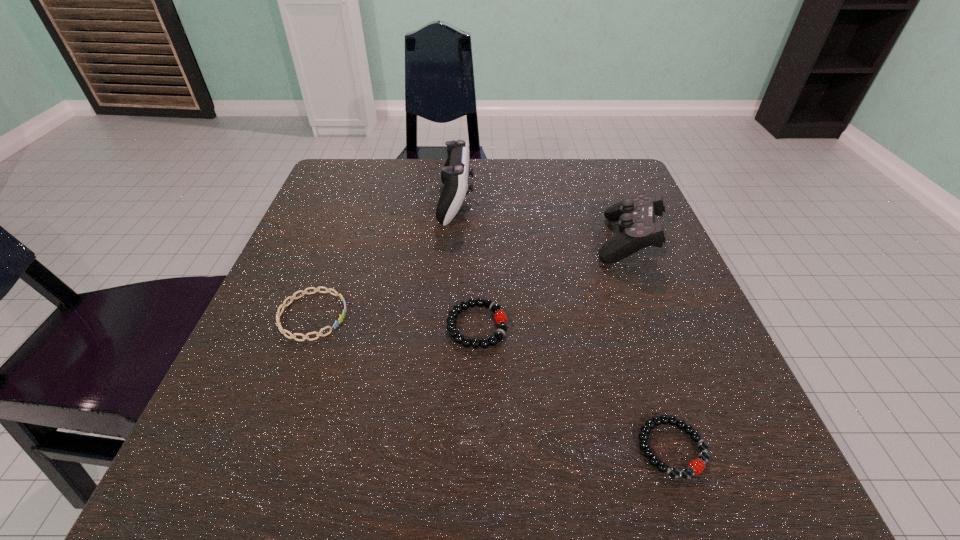
Find the location of a particular element. vacant space that satisfies the following two spatial constraints: 1. on the front side of the second bracelet from left to right; 2. on the right side of the nearest bracelet is located at coordinates (476, 448).

The height and width of the screenshot is (540, 960). What are the coordinates of `free location that satisfies the following two spatial constraints: 1. on the front-facing side of the taller control; 2. on the right side of the shorter control` in the screenshot? It's located at (454, 239).

In order to click on vacant position in the image that satisfies the following two spatial constraints: 1. on the front-facing side of the shorter control; 2. on the right side of the taller control in this screenshot , I will do `click(454, 239)`.

Where is `blank area in the image that satisfies the following two spatial constraints: 1. on the front-facing side of the left control; 2. on the right side of the rightmost bracelet`? blank area in the image that satisfies the following two spatial constraints: 1. on the front-facing side of the left control; 2. on the right side of the rightmost bracelet is located at coordinates (439, 448).

Identify the location of vacant space that satisfies the following two spatial constraints: 1. on the front-facing side of the left control; 2. on the back side of the shorter control. This screenshot has height=540, width=960. (454, 239).

Find the location of `vacant region that satisfies the following two spatial constraints: 1. on the front-facing side of the second bracelet from right to left; 2. on the right side of the left control`. vacant region that satisfies the following two spatial constraints: 1. on the front-facing side of the second bracelet from right to left; 2. on the right side of the left control is located at coordinates (447, 326).

At what (x,y) coordinates should I click in order to perform the action: click on free space that satisfies the following two spatial constraints: 1. on the back side of the second bracelet from left to right; 2. on the right side of the right control. Please return your answer as a coordinate pair (x, y). The height and width of the screenshot is (540, 960). Looking at the image, I should click on (477, 239).

Locate an element on the screen. The image size is (960, 540). vacant space that satisfies the following two spatial constraints: 1. on the front-facing side of the tallest object; 2. on the right side of the right control is located at coordinates (454, 239).

Where is `free region that satisfies the following two spatial constraints: 1. on the back side of the second bracelet from right to left; 2. on the right side of the shorter control`? free region that satisfies the following two spatial constraints: 1. on the back side of the second bracelet from right to left; 2. on the right side of the shorter control is located at coordinates (477, 239).

Identify the location of vacant space that satisfies the following two spatial constraints: 1. on the front-facing side of the nearest bracelet; 2. on the left side of the taller control. This screenshot has width=960, height=540. (439, 448).